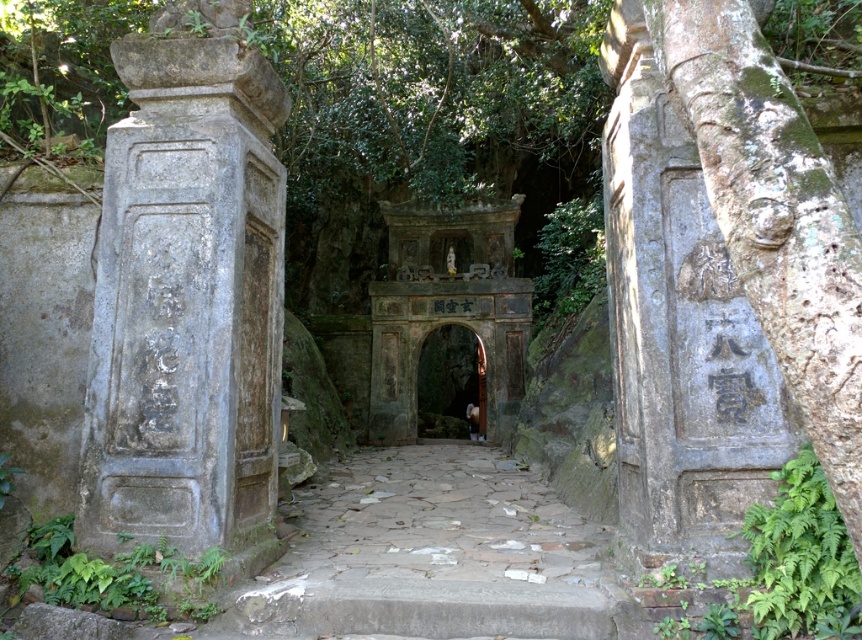
Question: Is stone paved path at center below green leafy plant at center?

Choices:
 (A) yes
 (B) no

Answer: (A)

Question: Which object appears farthest from the camera in this image?

Choices:
 (A) gray stone pillar at left
 (B) green leafy plant at center
 (C) smooth stone archway at center
 (D) gray stone pillar at center

Answer: (C)

Question: Which object is positioned closest to the green leafy plant at lower left?

Choices:
 (A) gray stone pillar at left
 (B) smooth stone archway at center
 (C) stone paved path at center

Answer: (A)

Question: Can you confirm if gray stone pillar at center is smaller than green leafy plant at lower left?

Choices:
 (A) no
 (B) yes

Answer: (A)

Question: Which of the following is the closest to the observer?

Choices:
 (A) stone paved path at center
 (B) gray stone pillar at center
 (C) gray stone pillar at left
 (D) smooth stone archway at center

Answer: (B)

Question: Can you confirm if gray stone pillar at center is bigger than smooth stone archway at center?

Choices:
 (A) yes
 (B) no

Answer: (B)